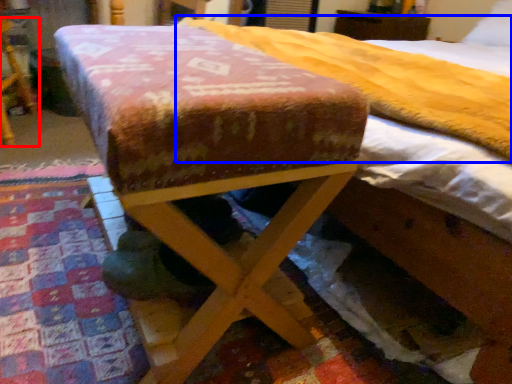
Question: Which of the following is the farthest to the observer, furniture (highlighted by a red box) or mattress (highlighted by a blue box)?

Choices:
 (A) furniture
 (B) mattress

Answer: (A)